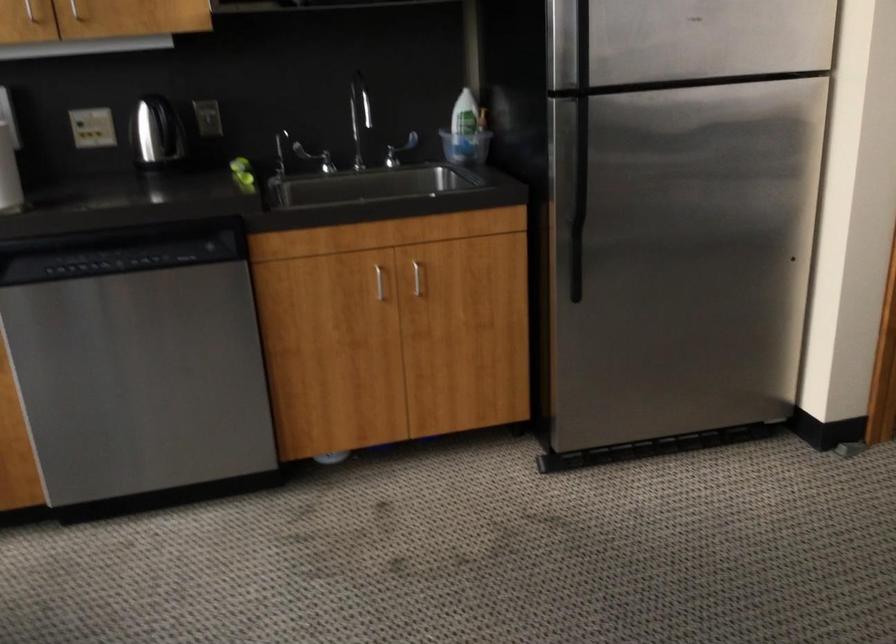
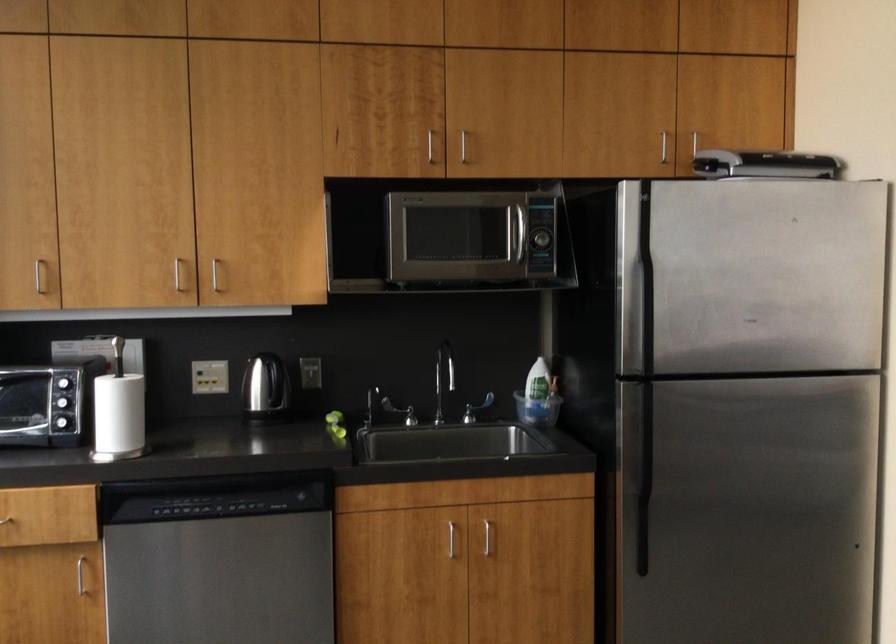
Find the pixel in the second image that matches point (579, 207) in the first image.

(643, 480)